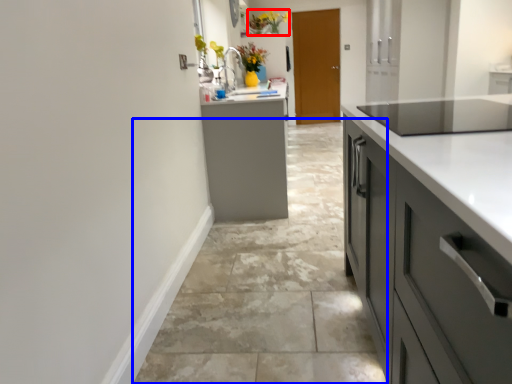
Question: Which object is closer to the camera taking this photo, floral arrangement (highlighted by a red box) or concrete (highlighted by a blue box)?

Choices:
 (A) floral arrangement
 (B) concrete

Answer: (B)